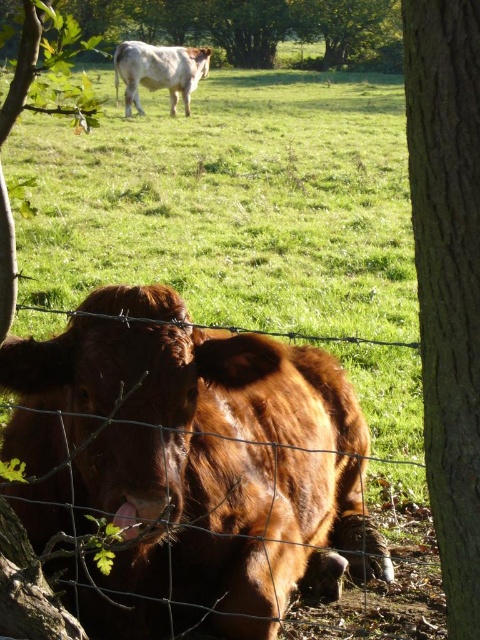
Question: Which of the following is the farthest from the observer?

Choices:
 (A) brown furry cow at lower left
 (B) green leafy tree at upper center
 (C) smooth brown bark at right

Answer: (A)

Question: Is shiny brown bull at lower left closer to camera compared to brown furry cow at lower left?

Choices:
 (A) yes
 (B) no

Answer: (B)

Question: Which of the following is the farthest from the observer?

Choices:
 (A) (391, 282)
 (B) (194, 49)
 (C) (399, 54)
 (D) (441, 152)

Answer: (C)

Question: Which object is the farthest from the shiny brown bull at lower left?

Choices:
 (A) white glossy cow at upper center
 (B) smooth brown bark at right

Answer: (A)

Question: Does smooth brown bark at right appear over green leafy tree at upper center?

Choices:
 (A) yes
 (B) no

Answer: (B)

Question: Does shiny brown bull at lower left appear under smooth brown bark at right?

Choices:
 (A) yes
 (B) no

Answer: (A)